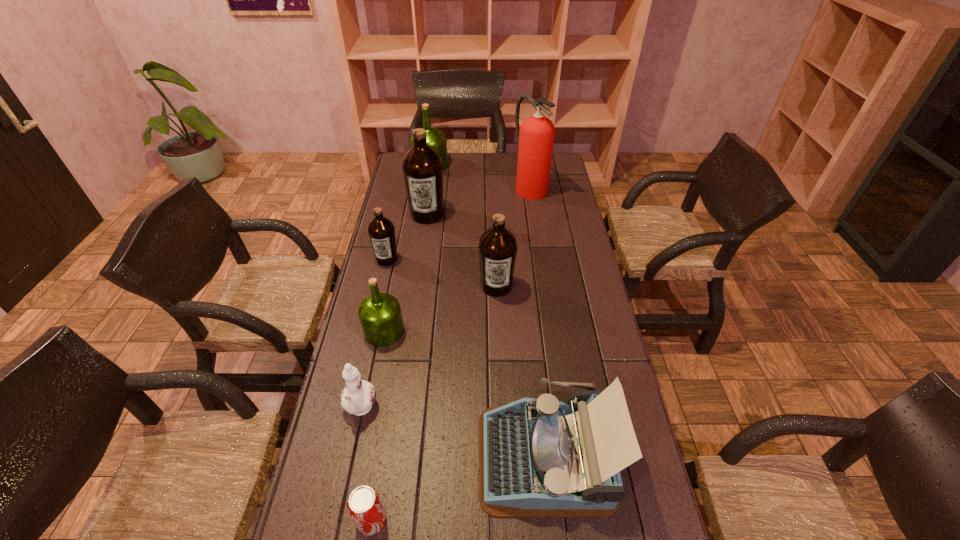
Find the location of a particular element. This screenshot has width=960, height=540. typewriter situated at the right edge is located at coordinates (542, 457).

Find the location of a particular element. The image size is (960, 540). object present at the far left corner is located at coordinates (436, 139).

Find the location of a particular element. The height and width of the screenshot is (540, 960). object present at the far right corner is located at coordinates (535, 137).

Where is `vacant space at the far edge of the desktop`? The height and width of the screenshot is (540, 960). vacant space at the far edge of the desktop is located at coordinates (450, 173).

Find the location of a particular element. free space at the left edge of the desktop is located at coordinates (329, 439).

The height and width of the screenshot is (540, 960). Identify the location of vacant space at the right edge of the desktop. [x=582, y=295].

Where is `free space at the far right corner of the desktop`? free space at the far right corner of the desktop is located at coordinates (555, 168).

Where is `vacant area that lies between the nearest olive oil and the chinaware`? vacant area that lies between the nearest olive oil and the chinaware is located at coordinates coord(372,370).

The height and width of the screenshot is (540, 960). I want to click on free space that is in between the tallest olive oil and the typewriter, so click(486, 335).

The image size is (960, 540). Find the location of `unoccupied position between the soda can and the nearer green olive oil`. unoccupied position between the soda can and the nearer green olive oil is located at coordinates (378, 426).